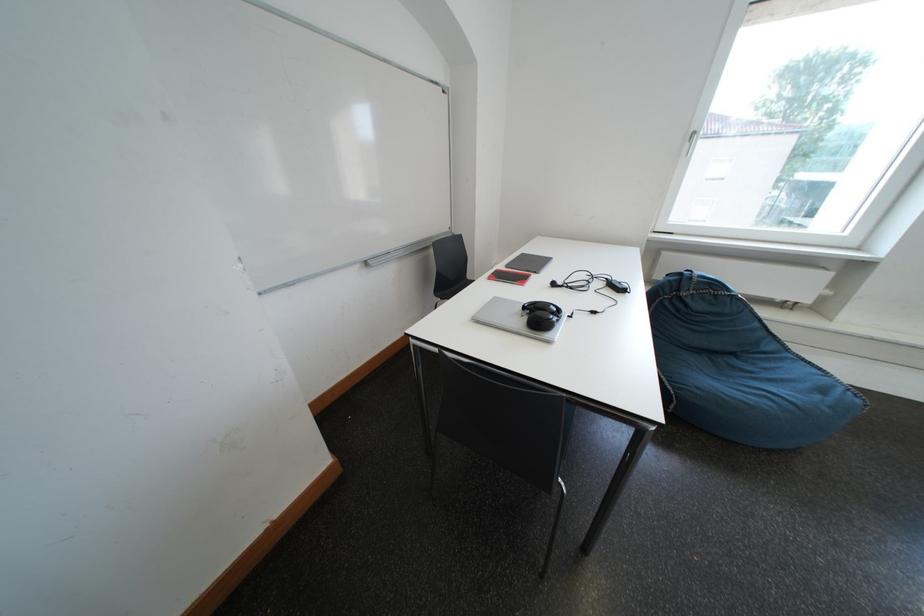
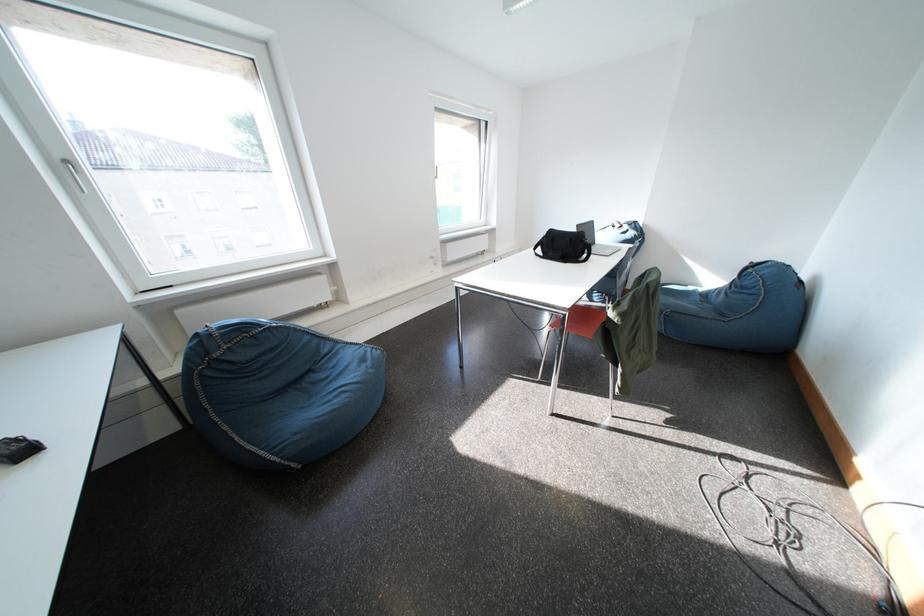
The first image is from the beginning of the video and the second image is from the end. How did the camera likely rotate when shooting the video?

The camera's rotation is toward right-down.